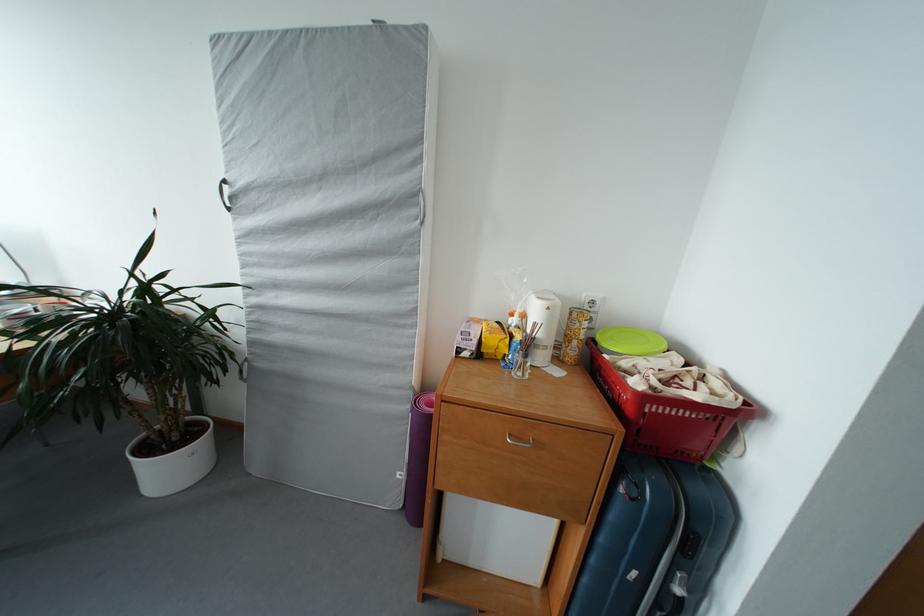
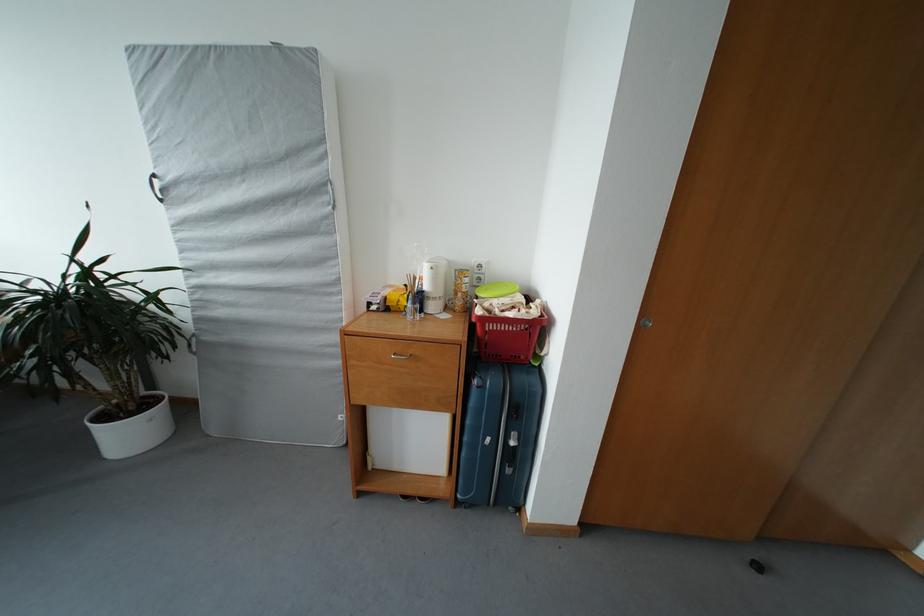
Where in the second image is the point corresponding to point (596, 323) from the first image?

(485, 284)